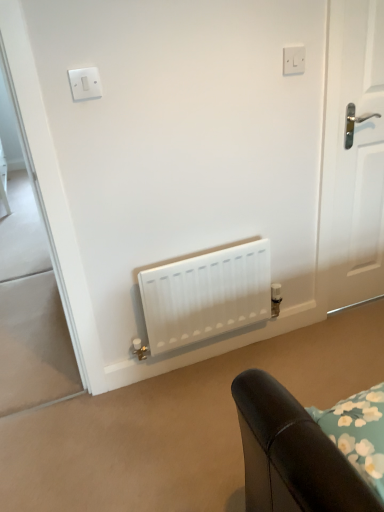
Question: Is white plastic light switch at upper left bigger than white glossy door at right?

Choices:
 (A) no
 (B) yes

Answer: (A)

Question: Is white plastic light switch at upper left smaller than white glossy door at right?

Choices:
 (A) yes
 (B) no

Answer: (A)

Question: Does white plastic light switch at upper left turn towards white glossy door at right?

Choices:
 (A) no
 (B) yes

Answer: (A)

Question: Considering the relative sizes of white plastic light switch at upper left and white glossy door at right in the image provided, is white plastic light switch at upper left shorter than white glossy door at right?

Choices:
 (A) no
 (B) yes

Answer: (B)

Question: Is white plastic light switch at upper left outside white glossy door at right?

Choices:
 (A) no
 (B) yes

Answer: (B)

Question: Would you consider white plastic light switch at upper left to be distant from white glossy door at right?

Choices:
 (A) no
 (B) yes

Answer: (B)

Question: Does white plastic light switch at upper left have a lesser height compared to white matte radiator at center?

Choices:
 (A) no
 (B) yes

Answer: (B)

Question: From a real-world perspective, is white plastic light switch at upper left over white matte radiator at center?

Choices:
 (A) no
 (B) yes

Answer: (B)

Question: Is white plastic light switch at upper left closer to the viewer compared to white matte radiator at center?

Choices:
 (A) no
 (B) yes

Answer: (B)

Question: Can we say white plastic light switch at upper left lies outside white matte radiator at center?

Choices:
 (A) yes
 (B) no

Answer: (A)

Question: Is there a large distance between white plastic light switch at upper left and white matte radiator at center?

Choices:
 (A) no
 (B) yes

Answer: (A)

Question: Would you say white plastic light switch at upper left contains white matte radiator at center?

Choices:
 (A) no
 (B) yes

Answer: (A)

Question: From a real-world perspective, is white matte radiator at center under white plastic switch at upper center?

Choices:
 (A) yes
 (B) no

Answer: (A)